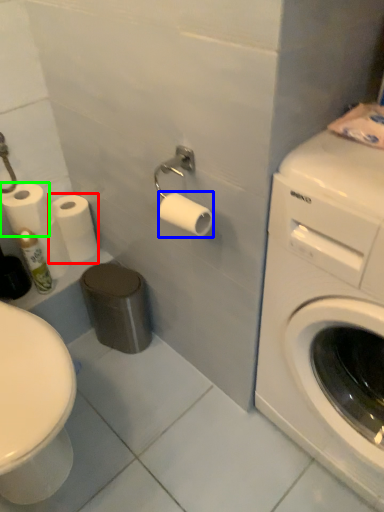
Question: Based on their relative distances, which object is nearer to toilet paper (highlighted by a red box)? Choose from toilet paper (highlighted by a blue box) and toilet paper (highlighted by a green box).

Choices:
 (A) toilet paper
 (B) toilet paper

Answer: (B)